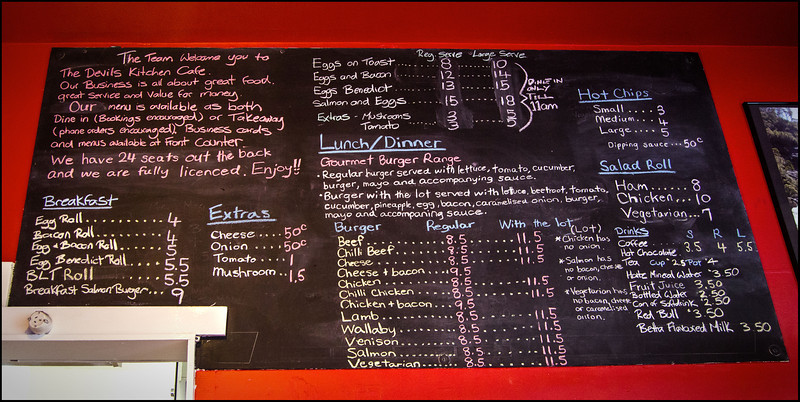
Locate an element on the screen. The width and height of the screenshot is (800, 402). wall beneath board is located at coordinates (394, 382).